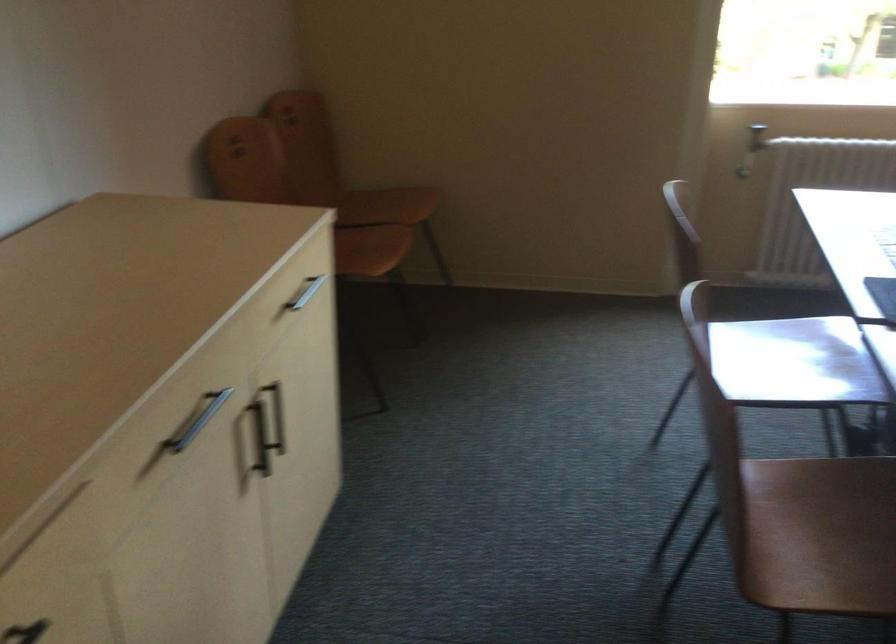
Image resolution: width=896 pixels, height=644 pixels. In order to click on radiator valve knob in this screenshot , I will do `click(743, 172)`.